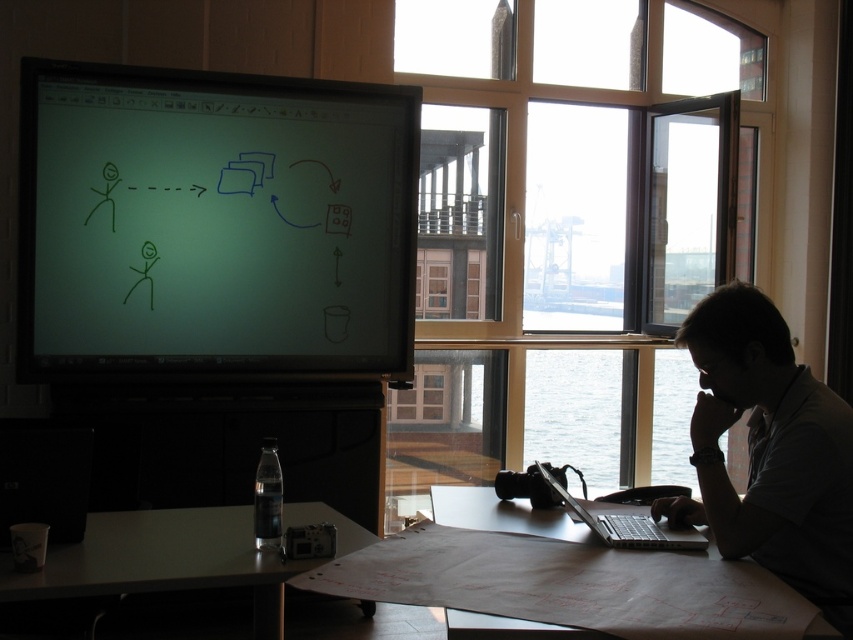
Question: Can you confirm if matte green screen at upper left is wider than dark gray shirt at right?

Choices:
 (A) yes
 (B) no

Answer: (A)

Question: Can you confirm if matte green screen at upper left is positioned to the left of white matte table at lower left?

Choices:
 (A) no
 (B) yes

Answer: (B)

Question: Which point is farther to the camera?

Choices:
 (A) (346, 356)
 (B) (579, 58)

Answer: (B)

Question: Which point is farther from the camera taking this photo?

Choices:
 (A) (428, 417)
 (B) (91, 593)

Answer: (A)

Question: Does dark gray shirt at right appear on the left side of transparent glass window at center?

Choices:
 (A) no
 (B) yes

Answer: (A)

Question: Which object is the farthest from the transparent glass window at center?

Choices:
 (A) matte green screen at upper left
 (B) white matte table at lower left
 (C) transparent glass window at upper center
 (D) silver metallic laptop at lower right

Answer: (D)